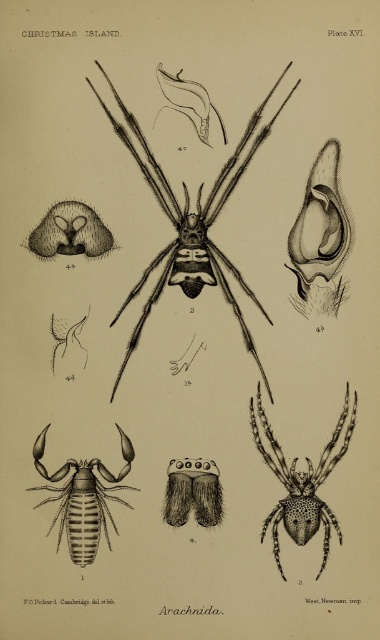
Question: Which object appears farthest from the camera in this image?

Choices:
 (A) brown fuzzy spider at center
 (B) brown striped scorpion at lower left
 (C) black ink spider at center

Answer: (A)

Question: Does brown striped scorpion at lower left come behind brown fuzzy spider at center?

Choices:
 (A) no
 (B) yes

Answer: (A)

Question: Estimate the real-world distances between objects in this image. Which object is closer to the brown striped scorpion at lower left?

Choices:
 (A) black dotted spider at center
 (B) black ink spider at center

Answer: (A)

Question: Does brown striped scorpion at lower left appear under brown fuzzy spider at center?

Choices:
 (A) yes
 (B) no

Answer: (A)

Question: Which is farther from the black dotted spider at center?

Choices:
 (A) brown fuzzy spider at center
 (B) black ink spider at center

Answer: (B)

Question: Is black ink spider at center smaller than brown striped scorpion at lower left?

Choices:
 (A) yes
 (B) no

Answer: (B)